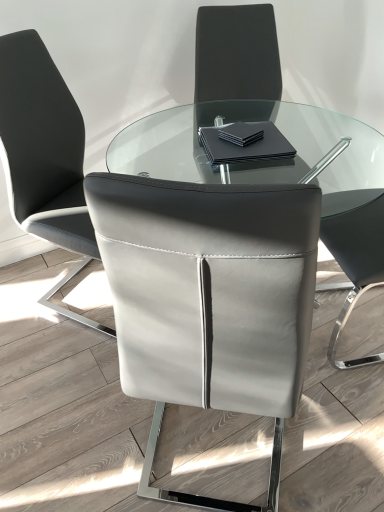
The image size is (384, 512). Find the location of `free space in front of white leather chair at center, marked as the 2th chair in a right-to-left arrangement`. free space in front of white leather chair at center, marked as the 2th chair in a right-to-left arrangement is located at coordinates [64, 376].